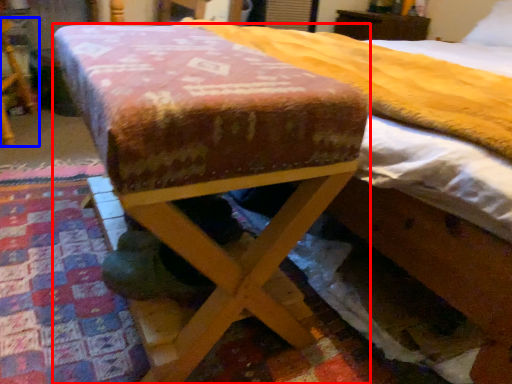
Question: Among these objects, which one is farthest to the camera, furniture (highlighted by a red box) or furniture (highlighted by a blue box)?

Choices:
 (A) furniture
 (B) furniture

Answer: (B)